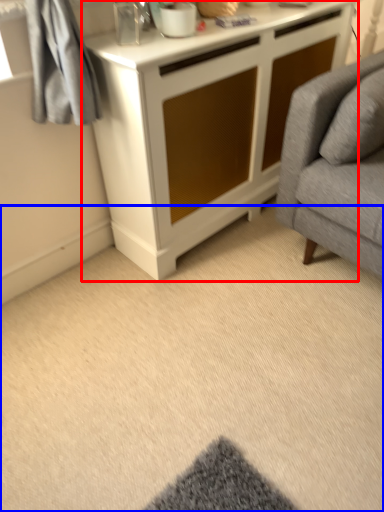
Question: Which of the following is the closest to the observer, cabinetry (highlighted by a red box) or plain (highlighted by a blue box)?

Choices:
 (A) cabinetry
 (B) plain

Answer: (B)